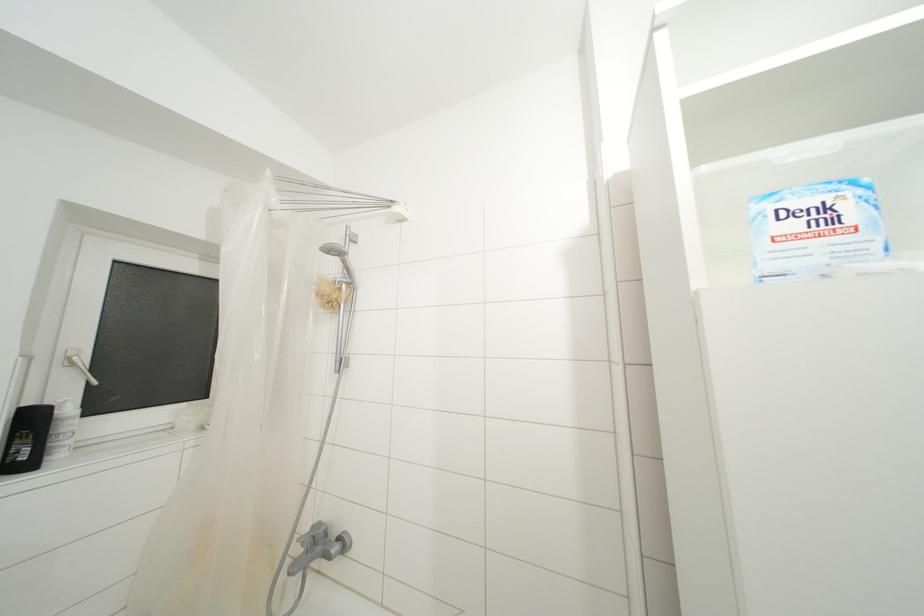
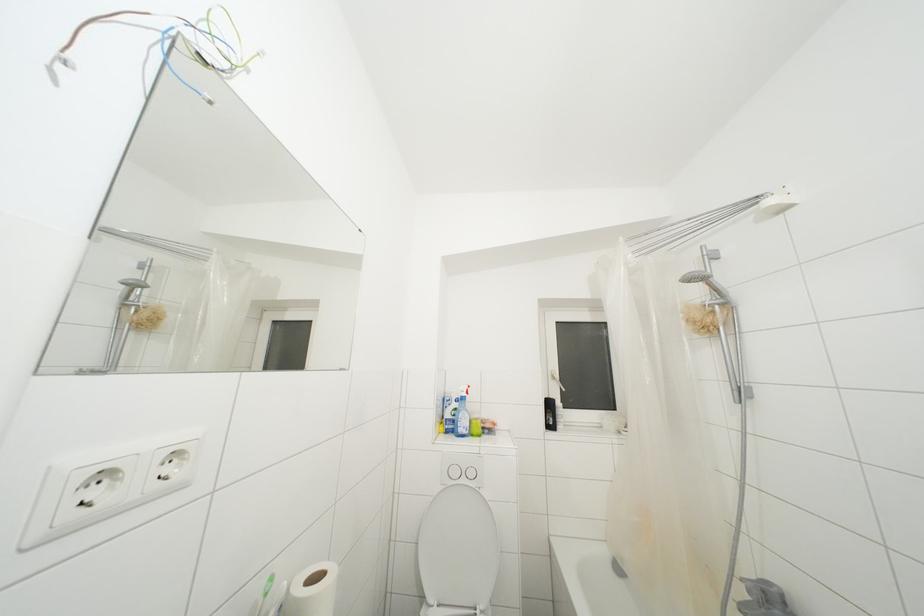
Question: The camera is either moving clockwise (left) or counter-clockwise (right) around the object. The first image is from the beginning of the video and the second image is from the end. Is the camera moving left or right when shooting the video?

Choices:
 (A) Left
 (B) Right

Answer: (B)